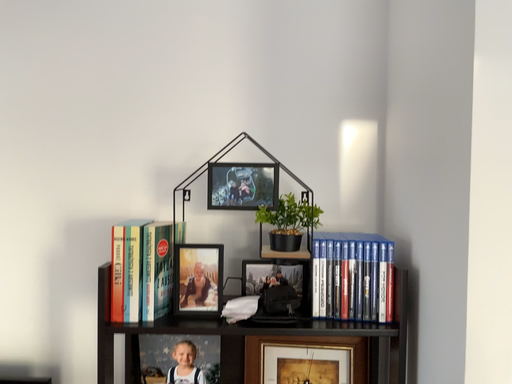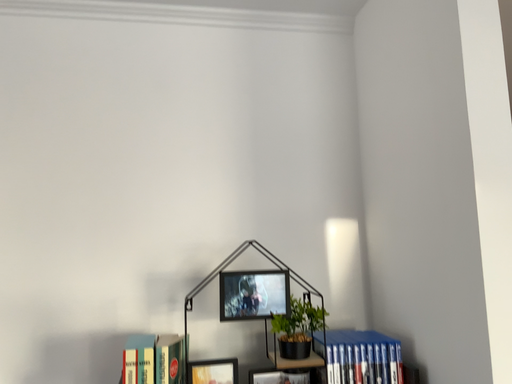
Question: How did the camera likely rotate when shooting the video?

Choices:
 (A) rotated downward
 (B) rotated upward

Answer: (B)